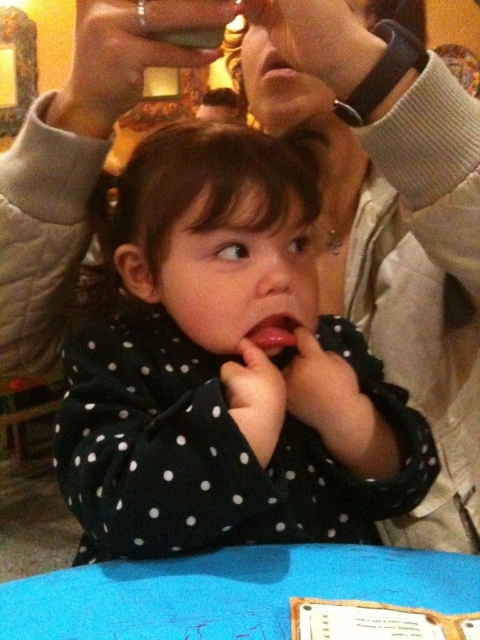
Question: Among these objects, which one is nearest to the camera?

Choices:
 (A) blue fabric table at lower center
 (B) black dotted shirt at center

Answer: (A)

Question: Does black dotted shirt at center appear on the left side of matte plastic cup at upper center?

Choices:
 (A) yes
 (B) no

Answer: (B)

Question: Considering the relative positions of black dotted shirt at center and blue fabric table at lower center in the image provided, where is black dotted shirt at center located with respect to blue fabric table at lower center?

Choices:
 (A) above
 (B) below

Answer: (A)

Question: Based on their relative distances, which object is nearer to the blue fabric table at lower center?

Choices:
 (A) black dotted shirt at center
 (B) matte plastic cup at upper center

Answer: (A)

Question: Which object is positioned farthest from the matte plastic cup at upper center?

Choices:
 (A) blue fabric table at lower center
 (B) black dotted shirt at center

Answer: (A)

Question: Is black dotted shirt at center smaller than blue fabric table at lower center?

Choices:
 (A) no
 (B) yes

Answer: (A)